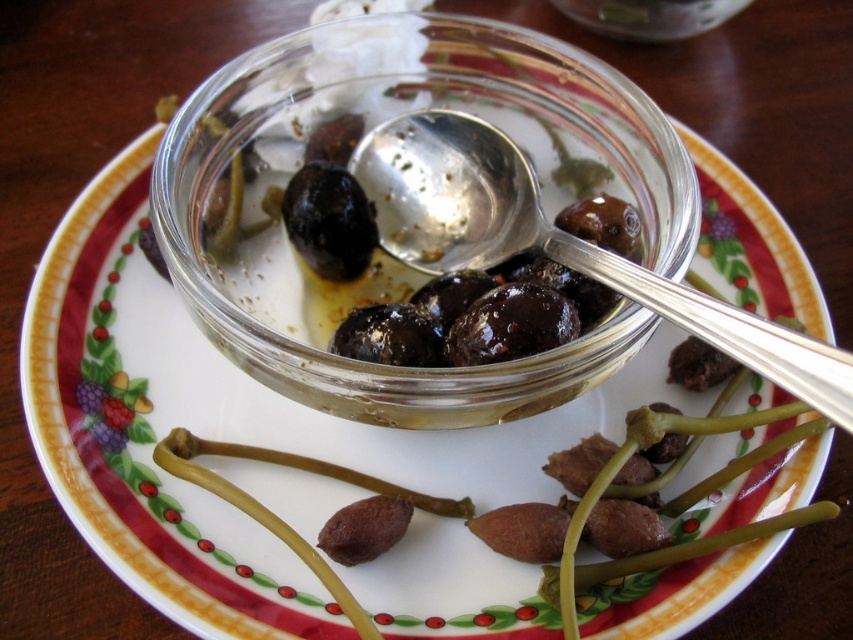
Question: Can you confirm if silver metallic spoon at center is bigger than shiny black olive at center?

Choices:
 (A) no
 (B) yes

Answer: (B)

Question: Which point is closer to the camera?

Choices:
 (A) silver metallic spoon at center
 (B) shiny black olive at center
 (C) transparent glass bowl at center

Answer: (A)

Question: Which point is farther from the camera taking this photo?

Choices:
 (A) (311, 42)
 (B) (410, 211)

Answer: (B)

Question: Where is transparent glass bowl at center located in relation to silver metallic spoon at center in the image?

Choices:
 (A) left
 (B) right

Answer: (A)

Question: Does silver metallic spoon at center appear on the right side of shiny black olive at center?

Choices:
 (A) yes
 (B) no

Answer: (A)

Question: Which point is farther from the camera taking this photo?

Choices:
 (A) (460, 216)
 (B) (402, 404)
 (C) (316, 230)

Answer: (A)